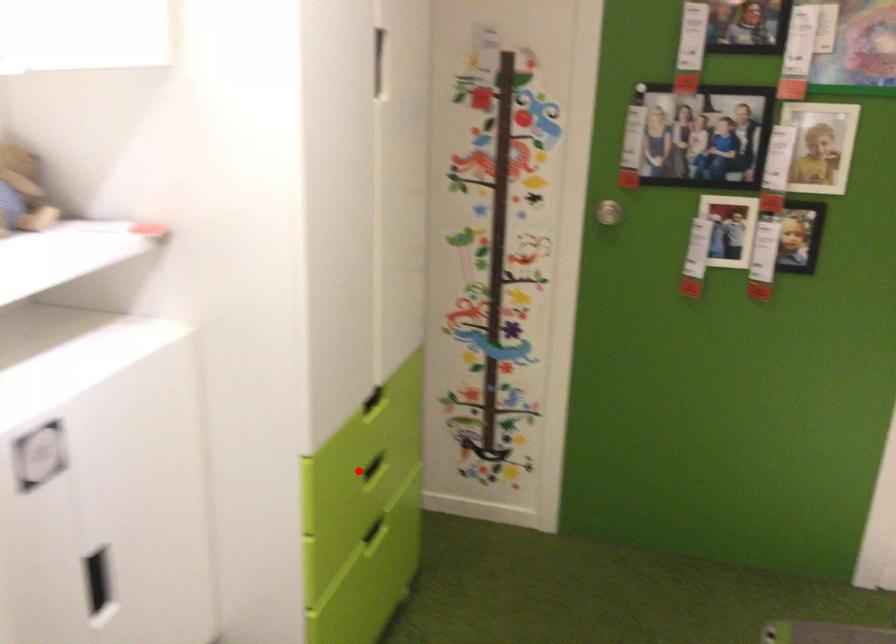
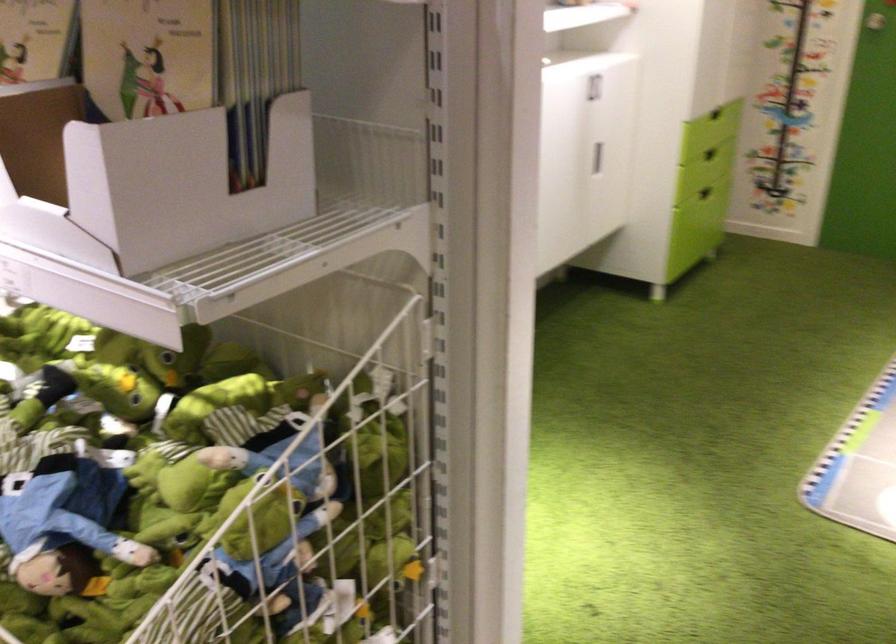
Question: I am providing you with two images of the same scene from different viewpoints. Given a red point in image1, look at the same physical point in image2. Is it:

Choices:
 (A) Closer to the viewpoint
 (B) Farther from the viewpoint

Answer: (B)